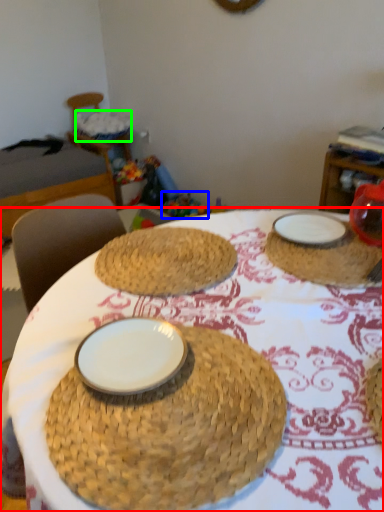
Question: Considering the real-world distances, which object is farthest from table (highlighted by a red box)? toy (highlighted by a blue box) or basket (highlighted by a green box)?

Choices:
 (A) toy
 (B) basket

Answer: (B)